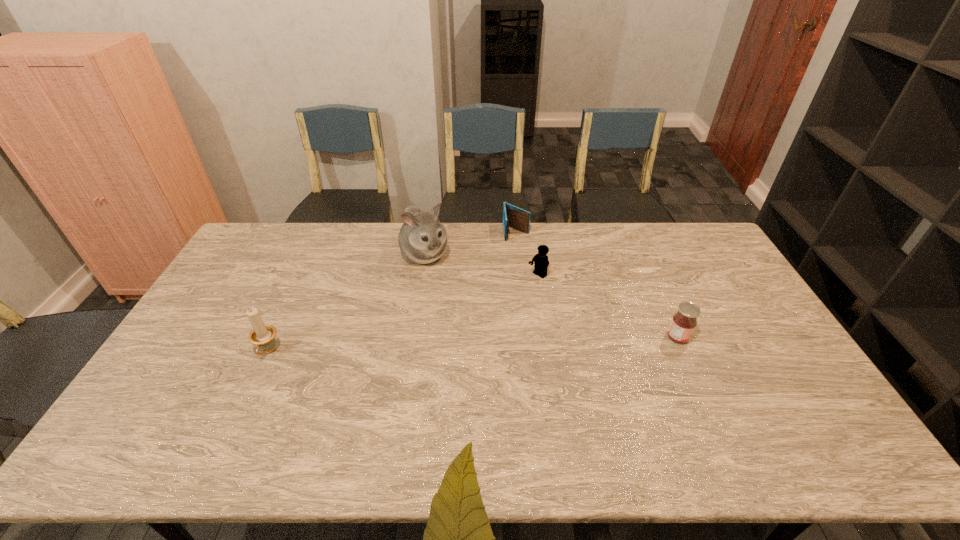
At what (x,y) coordinates should I click in order to perform the action: click on free area in between the leftmost object and the tallest object. Please return your answer as a coordinate pair (x, y). The height and width of the screenshot is (540, 960). Looking at the image, I should click on (347, 303).

Where is `vacant region between the Lego and the rightmost object`? vacant region between the Lego and the rightmost object is located at coordinates (608, 307).

This screenshot has width=960, height=540. What are the coordinates of `free space between the Lego and the jam` in the screenshot? It's located at (608, 307).

Locate an element on the screen. This screenshot has height=540, width=960. blank region between the hamster and the rightmost object is located at coordinates (551, 296).

Locate an element on the screen. free space between the leftmost object and the rightmost object is located at coordinates (473, 345).

The height and width of the screenshot is (540, 960). What are the coordinates of `empty space between the leftmost object and the jam` in the screenshot? It's located at (473, 345).

Select which object appears as the fourth closest to the tallest object. Please provide its 2D coordinates. Your answer should be formatted as a tuple, i.e. [(x, y)], where the tuple contains the x and y coordinates of a point satisfying the conditions above.

[(684, 322)]

Select which object appears as the fourth closest to the second tallest object. Please provide its 2D coordinates. Your answer should be formatted as a tuple, i.e. [(x, y)], where the tuple contains the x and y coordinates of a point satisfying the conditions above.

[(684, 322)]

The image size is (960, 540). Identify the location of free region that satisfies the following two spatial constraints: 1. on the front side of the shortest object; 2. on the label side of the jam. tap(527, 338).